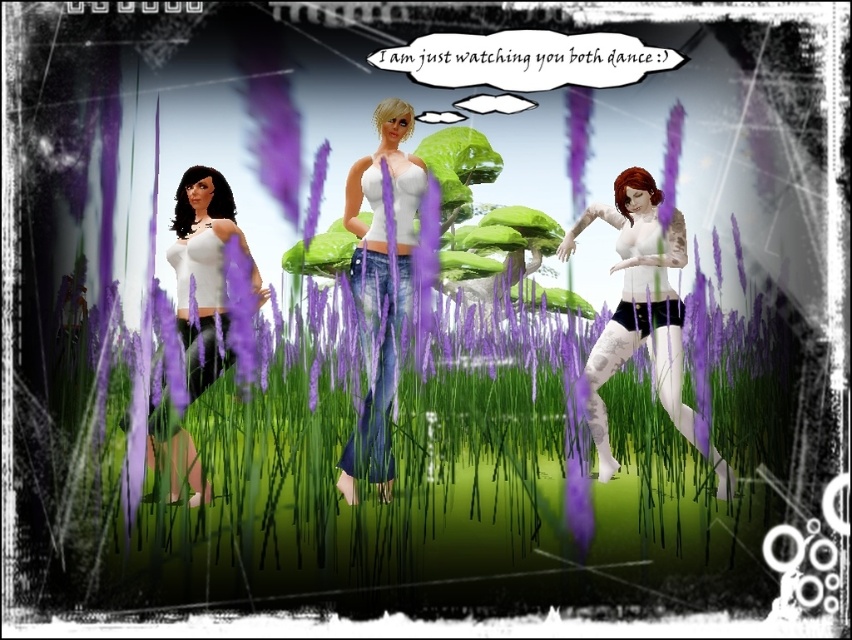
Question: Considering the real-world distances, which object is closest to the white matte dress at left?

Choices:
 (A) purple matte lavender at center
 (B) matte white tank top at left
 (C) purple grass at center
 (D) white matte leggings at center

Answer: (B)

Question: Does white matte leggings at center have a lesser width compared to matte white tank top at left?

Choices:
 (A) yes
 (B) no

Answer: (B)

Question: Which object appears farthest from the camera in this image?

Choices:
 (A) matte purple lavender at upper center
 (B) matte white tank top at left
 (C) white matte tank top at center
 (D) white matte leggings at center

Answer: (A)

Question: Does white matte leggings at center appear over purple matte lavender at center?

Choices:
 (A) no
 (B) yes

Answer: (A)

Question: Is purple grass at center smaller than matte purple lavender at upper center?

Choices:
 (A) yes
 (B) no

Answer: (B)

Question: Which point is farther to the camera?

Choices:
 (A) purple matte lavender at center
 (B) matte purple lavender at upper center
 (C) white matte leggings at center

Answer: (B)